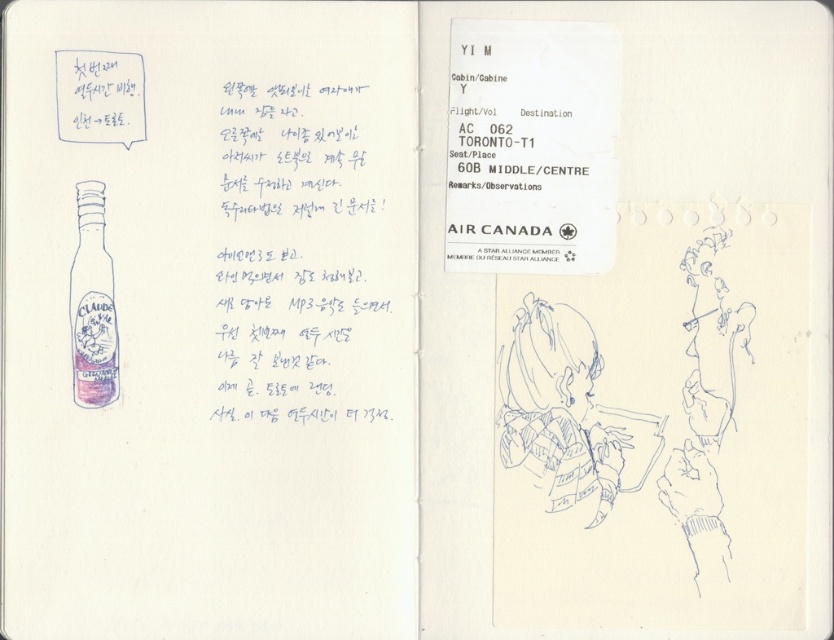
You are organizing a small exhibition of travel memorabilia and have these two items on display. The black paper at center is your Air Canada flight ticket, and the matte glass bottle at left is a souvenir from your trip. A visitor asks which item is taller. How do you respond?

The black paper at center is much taller than the matte glass bottle at left, so the Air Canada flight ticket is taller.

You are organizing a small gift set and need to place both the black paper at center and the matte glass bottle at left into a rectangular box. The box has a length of 15 cm and a width of 10 cm. Can both items fit inside the box without overlapping?

The black paper at center is bigger than the matte glass bottle at left. However, since the box dimensions are 15 cm in length and 10 cm in width, it is possible that both items can fit if arranged properly, but the exact dimensions of the items are not provided. Without knowing their exact sizes, we cannot confirm for sure.